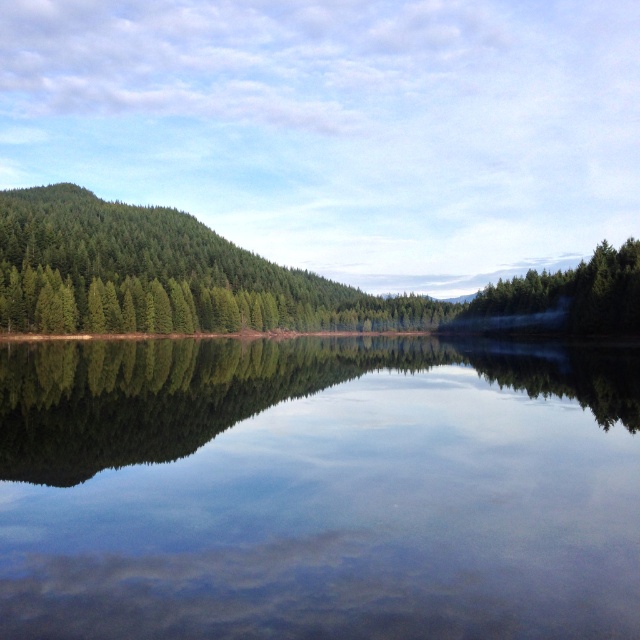
You are an artist sketching the landscape. You notice the green textured forest at left and the green matte tree at right. Which object is positioned higher in the image?

The green textured forest at left is positioned higher in the image than the green matte tree at right.

You are standing at the center of the image and see the point marked at point (161,275). Which direction should you face to look towards the green textured forest at left where the point is located?

The point (161,275) is located on the green textured forest at left, so you should face towards the left direction to look towards the green textured forest at left where the point is located.